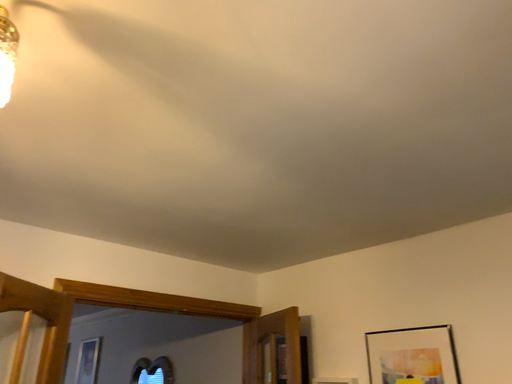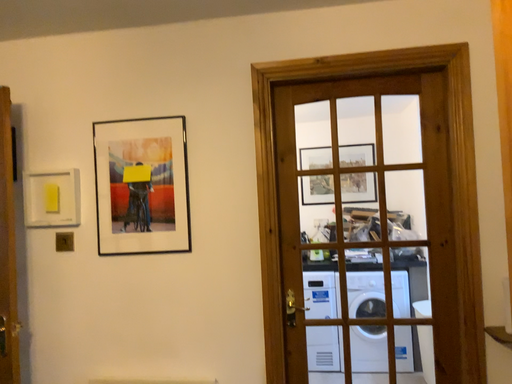
Question: How did the camera likely rotate when shooting the video?

Choices:
 (A) rotated right
 (B) rotated left

Answer: (A)